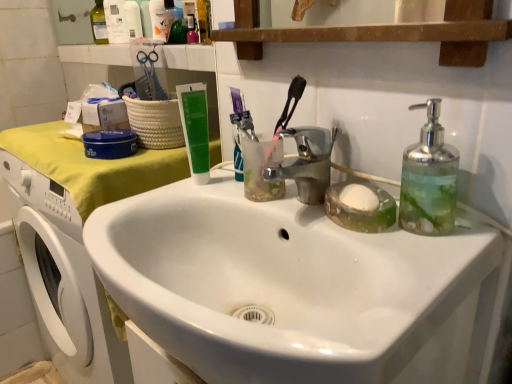
Find the location of `free space that is to the left of chrome metallic faucet at center`. free space that is to the left of chrome metallic faucet at center is located at coordinates (160, 201).